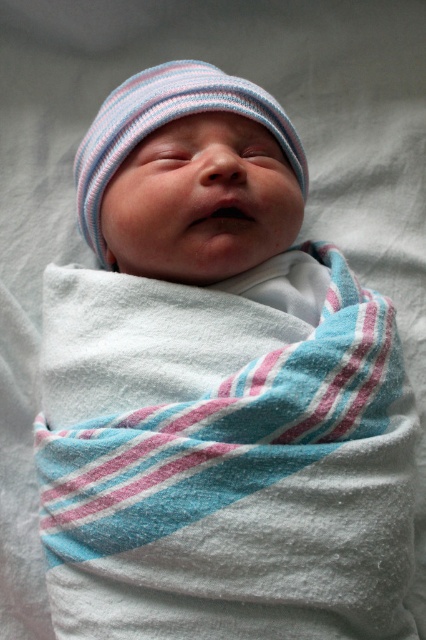
Question: Which of the following is the closest to the observer?

Choices:
 (A) striped knit hat at center
 (B) white soft blanket at center

Answer: (B)

Question: From the image, what is the correct spatial relationship of white soft blanket at center in relation to striped knit hat at center?

Choices:
 (A) right
 (B) left

Answer: (A)

Question: Which point is closer to the camera?

Choices:
 (A) striped knit hat at center
 (B) white soft blanket at center

Answer: (B)

Question: Observing the image, what is the correct spatial positioning of white soft blanket at center in reference to striped knit hat at center?

Choices:
 (A) below
 (B) above

Answer: (A)

Question: Can you confirm if white soft blanket at center is positioned above striped knit hat at center?

Choices:
 (A) no
 (B) yes

Answer: (A)